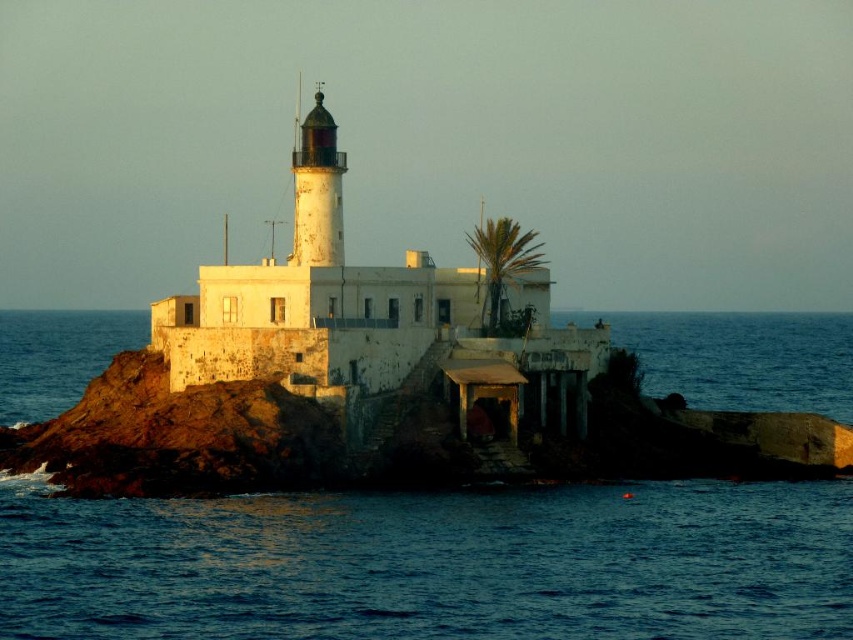
Is blue water at center in front of green leafy palm at upper center?

Yes, blue water at center is closer to the viewer.

This screenshot has height=640, width=853. Find the location of `blue water at center`. blue water at center is located at coordinates (432, 564).

Where is `blue water at center`? This screenshot has height=640, width=853. blue water at center is located at coordinates (432, 564).

Can you confirm if blue water at center is positioned below dark blue water at lower left?

No.

Is point (608, 506) farther from camera compared to point (190, 563)?

Yes, point (608, 506) is farther from viewer.

Locate an element on the screen. The height and width of the screenshot is (640, 853). blue water at center is located at coordinates (432, 564).

Is point (341, 241) closer to viewer compared to point (483, 234)?

Yes.

Which of these two, polished brass lighthouse at center or green leafy palm at upper center, stands shorter?

polished brass lighthouse at center is shorter.

Who is more forward, (335, 179) or (490, 284)?

Point (335, 179) is more forward.

Where is `polished brass lighthouse at center`? The height and width of the screenshot is (640, 853). polished brass lighthouse at center is located at coordinates (317, 189).